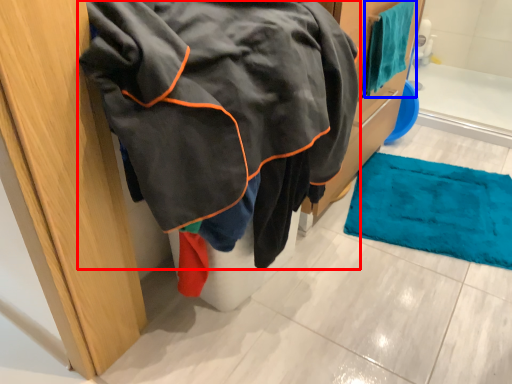
Question: Which point is further to the camera, jacket (highlighted by a red box) or towel (highlighted by a blue box)?

Choices:
 (A) jacket
 (B) towel

Answer: (B)